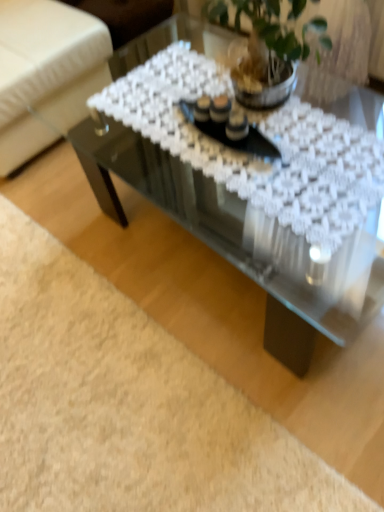
At what (x,y) coordinates should I click in order to perform the action: click on vacant area on top of transparent glass coffee table at center (from a real-world perspective). Please return your answer as a coordinate pair (x, y). The image size is (384, 512). Looking at the image, I should click on (243, 137).